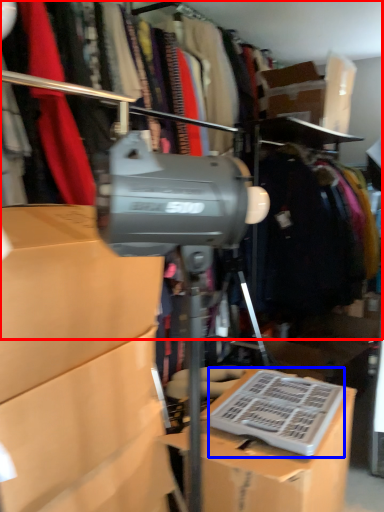
Question: Which object is closer to the camera taking this photo, closet (highlighted by a red box) or wide (highlighted by a blue box)?

Choices:
 (A) closet
 (B) wide

Answer: (A)